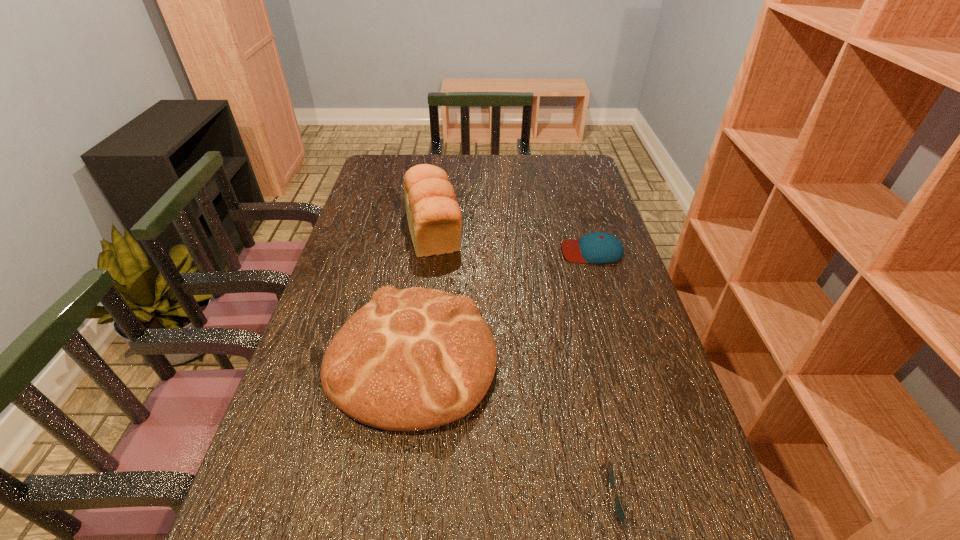
Image resolution: width=960 pixels, height=540 pixels. I want to click on the taller bread, so click(x=434, y=217).

Find the location of a particular element. the farther bread is located at coordinates (434, 217).

I want to click on the third shortest object, so click(x=413, y=359).

The height and width of the screenshot is (540, 960). In order to click on the third farthest object in this screenshot , I will do `click(413, 359)`.

Where is `the third tallest object`? This screenshot has width=960, height=540. the third tallest object is located at coordinates (598, 247).

Where is `free space located on the back of the taller bread`? This screenshot has width=960, height=540. free space located on the back of the taller bread is located at coordinates (442, 166).

Where is `free point located 0.160m on the right of the nearer bread`? This screenshot has height=540, width=960. free point located 0.160m on the right of the nearer bread is located at coordinates tap(564, 358).

You are a GUI agent. You are given a task and a screenshot of the screen. Output one action in this format:
    pyautogui.click(x=<x>, y=<y>)
    Task: Click on the free space located 0.150m with the bill of the third tallest object facing forward
    
    Given the screenshot: What is the action you would take?
    pyautogui.click(x=512, y=251)

Identify the location of free space located with the bill of the third tallest object facing forward. (452, 251).

Find the location of a particular element. The image size is (960, 540). vacant space situated with the bill of the third tallest object facing forward is located at coordinates (532, 251).